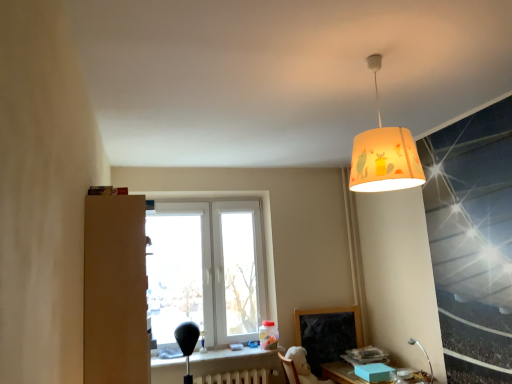
Question: Is matte yellow lampshade at upper center in contact with white plastic window at center?

Choices:
 (A) yes
 (B) no

Answer: (B)

Question: Considering the relative positions of matte yellow lampshade at upper center and white plastic window at center in the image provided, is matte yellow lampshade at upper center to the right of white plastic window at center from the viewer's perspective?

Choices:
 (A) yes
 (B) no

Answer: (A)

Question: Is matte yellow lampshade at upper center oriented away from white plastic window at center?

Choices:
 (A) yes
 (B) no

Answer: (B)

Question: Is matte yellow lampshade at upper center positioned in front of white plastic window at center?

Choices:
 (A) yes
 (B) no

Answer: (A)

Question: Considering the relative sizes of matte yellow lampshade at upper center and white plastic window at center in the image provided, is matte yellow lampshade at upper center smaller than white plastic window at center?

Choices:
 (A) no
 (B) yes

Answer: (B)

Question: In terms of size, does white painted metal radiator at lower center appear bigger or smaller than flexible metal table lamp at lower right?

Choices:
 (A) small
 (B) big

Answer: (B)

Question: From a real-world perspective, is white painted metal radiator at lower center physically located above or below flexible metal table lamp at lower right?

Choices:
 (A) above
 (B) below

Answer: (B)

Question: Is white painted metal radiator at lower center inside the boundaries of flexible metal table lamp at lower right, or outside?

Choices:
 (A) inside
 (B) outside

Answer: (B)

Question: Considering their positions, is white painted metal radiator at lower center located in front of or behind flexible metal table lamp at lower right?

Choices:
 (A) behind
 (B) front

Answer: (A)

Question: Is white painted metal radiator at lower center wider or thinner than white plush swivel chair at lower center?

Choices:
 (A) thin
 (B) wide

Answer: (A)

Question: In terms of height, does white painted metal radiator at lower center look taller or shorter compared to white plush swivel chair at lower center?

Choices:
 (A) short
 (B) tall

Answer: (A)

Question: Looking at the image, does white painted metal radiator at lower center seem bigger or smaller compared to white plush swivel chair at lower center?

Choices:
 (A) big
 (B) small

Answer: (B)

Question: Is point (230, 374) closer or farther from the camera than point (307, 367)?

Choices:
 (A) closer
 (B) farther

Answer: (B)

Question: Considering the positions of point (215, 372) and point (351, 158), is point (215, 372) closer or farther from the camera than point (351, 158)?

Choices:
 (A) closer
 (B) farther

Answer: (A)

Question: In the image, is matte black table at lower center, which ranks as the second table in right-to-left order, positioned in front of or behind matte yellow lampshade at upper center?

Choices:
 (A) front
 (B) behind

Answer: (B)